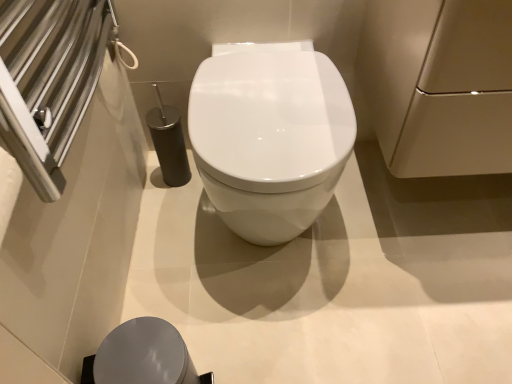
Where is `free point above matte gray lid at lower center (from a real-world perspective)`? free point above matte gray lid at lower center (from a real-world perspective) is located at coordinates (136, 346).